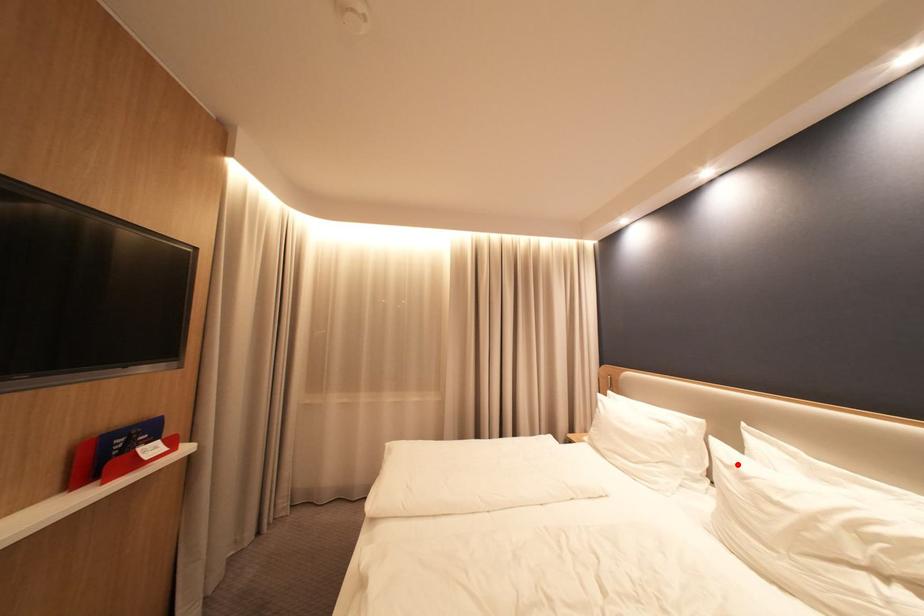
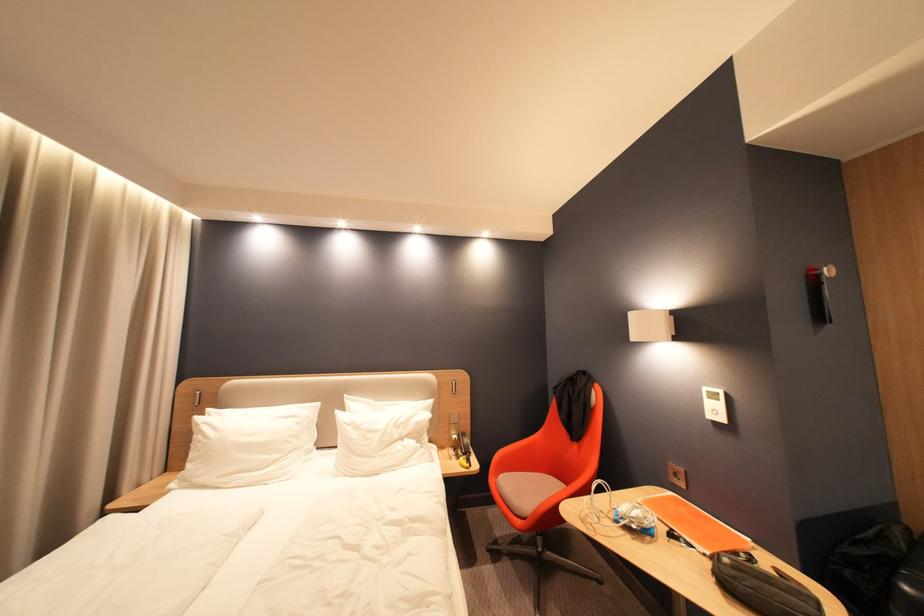
Locate, in the second image, the point that corresponds to the highlighted location in the first image.

(359, 424)